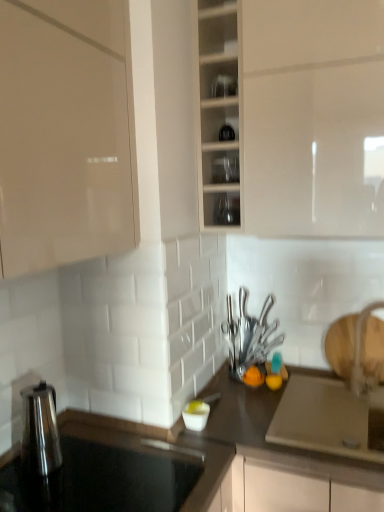
Image resolution: width=384 pixels, height=512 pixels. Identify the location of blank space to the left of white glossy faucet at right. (331, 398).